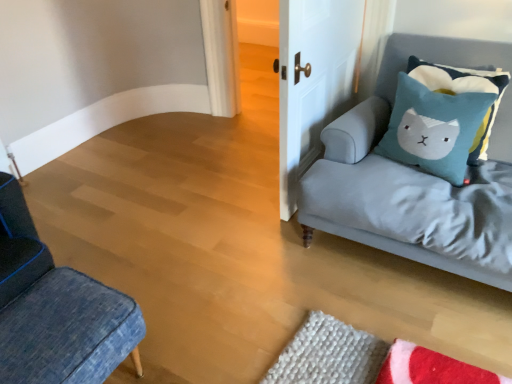
In order to click on free space above denim cushion at lower left (from a real-world perspective) in this screenshot , I will do `click(49, 320)`.